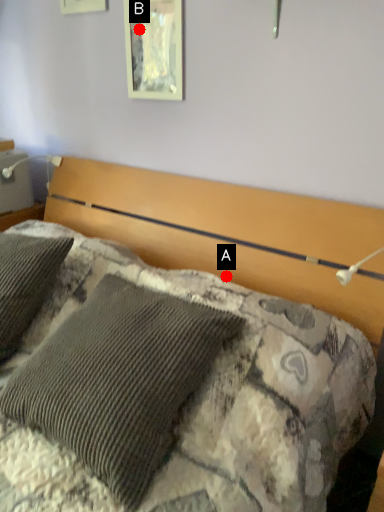
Question: Two points are circled on the image, labeled by A and B beside each circle. Which point is closer to the camera taking this photo?

Choices:
 (A) A is closer
 (B) B is closer

Answer: (A)